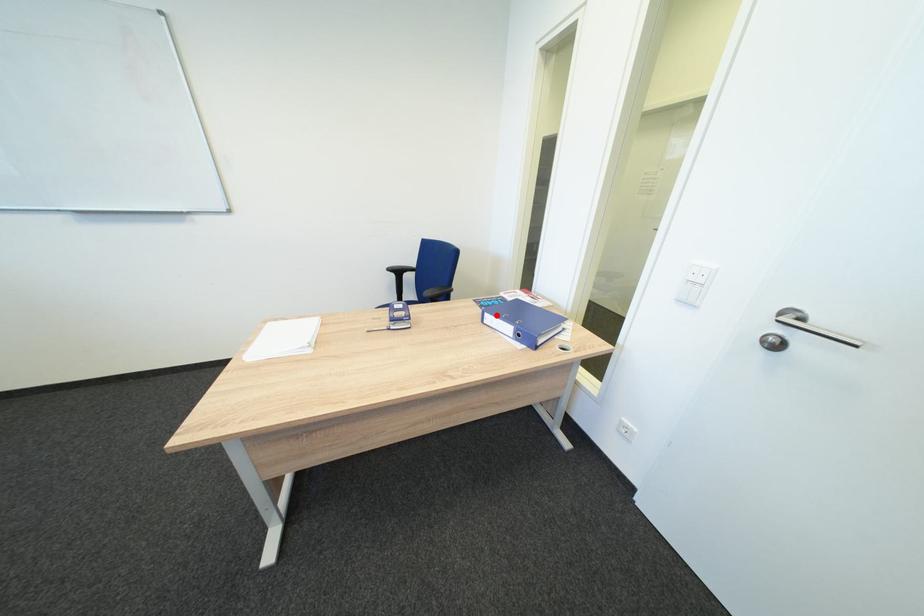
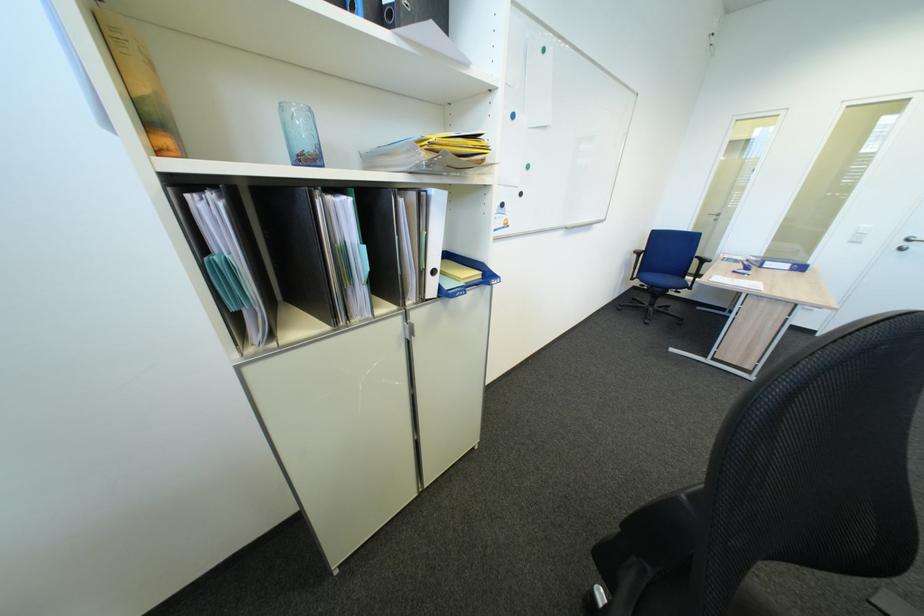
Find the pixel in the second image that matches the highlighted location in the first image.

(776, 264)